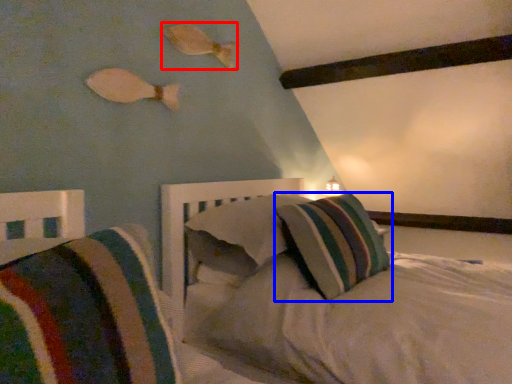
Question: Among these objects, which one is farthest to the camera, fish (highlighted by a red box) or pillow (highlighted by a blue box)?

Choices:
 (A) fish
 (B) pillow

Answer: (A)